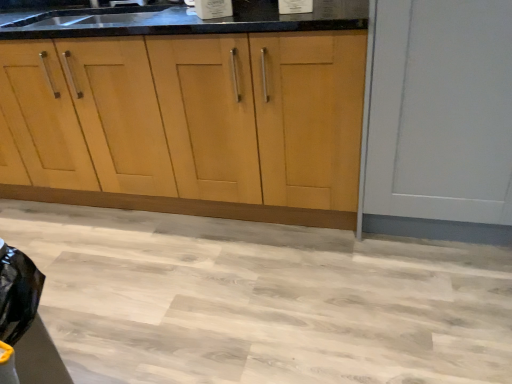
This screenshot has height=384, width=512. What do you see at coordinates (199, 117) in the screenshot?
I see `light wood cabinet at center` at bounding box center [199, 117].

In order to face light wood cabinet at center, should I rotate leftwards or rightwards?

To align with it, rotate left about 18.752°.

Find the location of `light wood cabinet at center`. light wood cabinet at center is located at coordinates (199, 117).

The width and height of the screenshot is (512, 384). In order to click on light wood cabinet at center in this screenshot , I will do `click(199, 117)`.